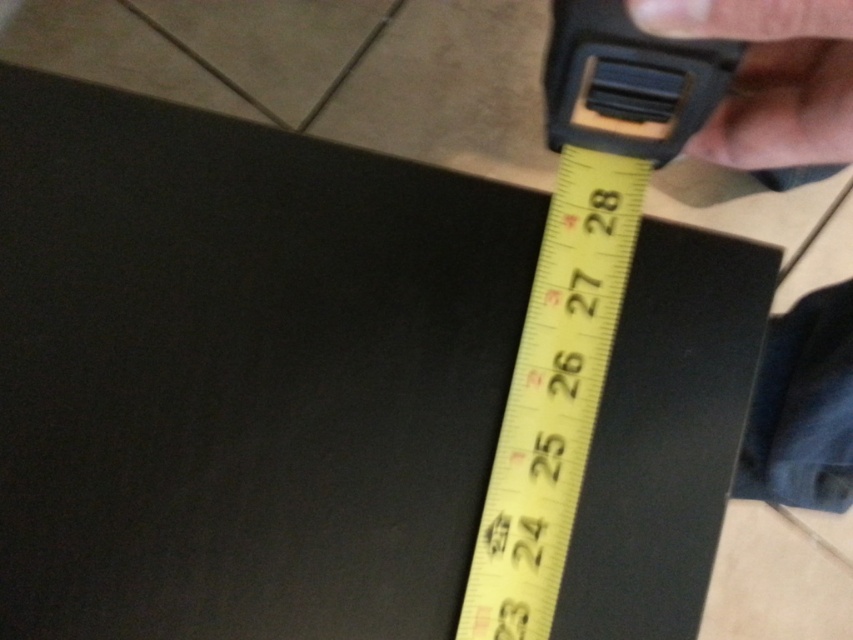
Question: Does yellow/yellowish plastic tape measure at upper right appear under skinny hand at upper right?

Choices:
 (A) no
 (B) yes

Answer: (A)

Question: Which object appears closest to the camera in this image?

Choices:
 (A) skinny leather wristwatch at upper right
 (B) yellow/yellowish plastic tape measure at upper right
 (C) skinny hand at upper right

Answer: (A)

Question: Which is farther from the skinny hand at upper right?

Choices:
 (A) yellow/yellowish plastic tape measure at upper right
 (B) skinny leather wristwatch at upper right

Answer: (B)

Question: Is yellow/yellowish plastic tape measure at upper right closer to camera compared to skinny hand at upper right?

Choices:
 (A) yes
 (B) no

Answer: (A)

Question: Does yellow/yellowish plastic tape measure at upper right have a lesser width compared to skinny hand at upper right?

Choices:
 (A) no
 (B) yes

Answer: (A)

Question: Which object is the farthest from the yellow/yellowish plastic tape measure at upper right?

Choices:
 (A) skinny hand at upper right
 (B) skinny leather wristwatch at upper right

Answer: (A)